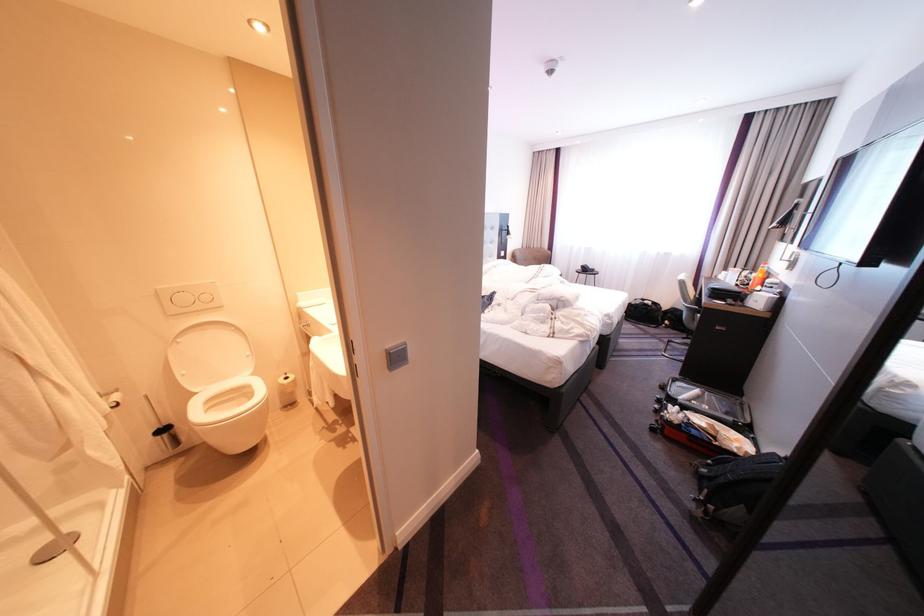
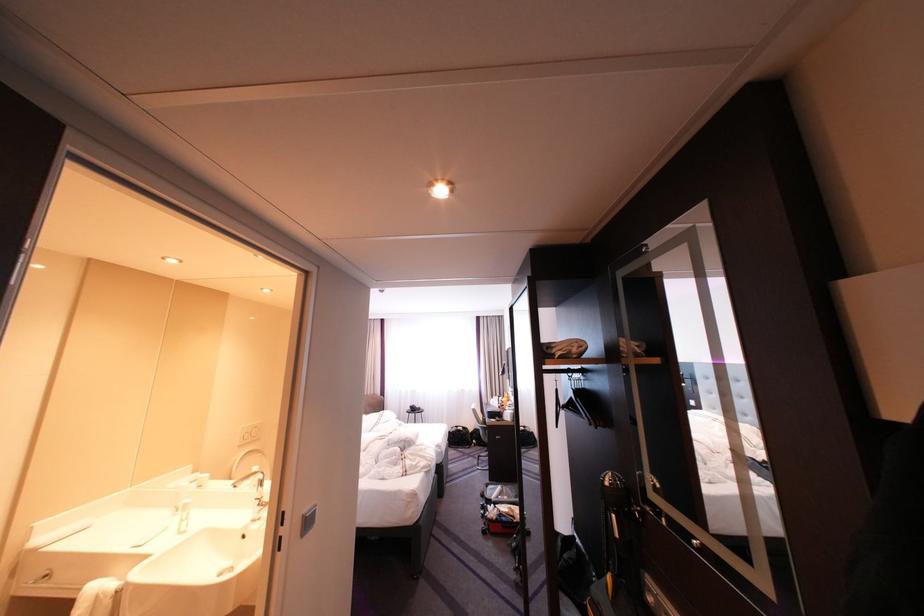
In the second image, find the point that corresponds to pixel 650 304 in the first image.

(467, 431)